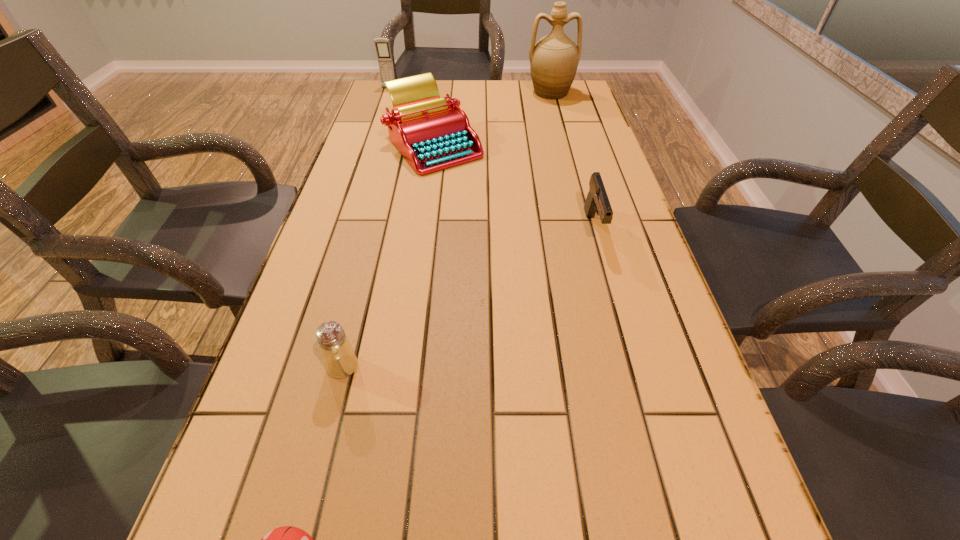
I want to click on the closest object to the second nearest object, so click(x=288, y=539).